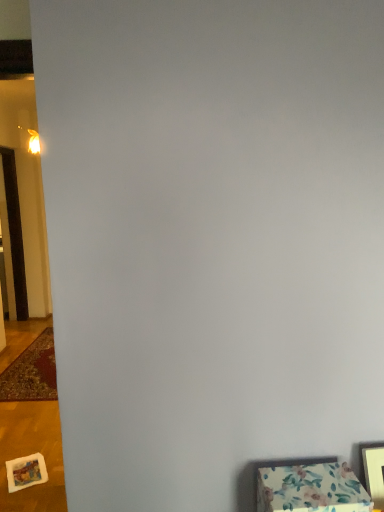
Question: Is point (21, 287) closer or farther from the camera than point (271, 479)?

Choices:
 (A) closer
 (B) farther

Answer: (B)

Question: From a real-world perspective, is brown wooden door at left physically located above or below floral fabric ottoman at lower right?

Choices:
 (A) above
 (B) below

Answer: (A)

Question: Based on their relative distances, which object is nearer to the floral fabric ottoman at lower right?

Choices:
 (A) brown wooden door at left
 (B) carpeted mat at left
 (C) wooden picture frame at lower right

Answer: (C)

Question: Which of these objects is positioned farthest from the brown wooden door at left?

Choices:
 (A) carpeted mat at left
 (B) wooden picture frame at lower right
 (C) floral fabric ottoman at lower right

Answer: (B)